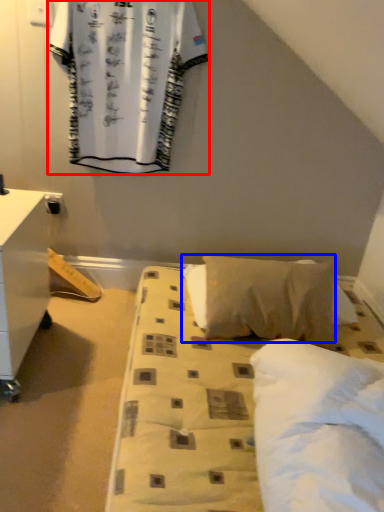
Question: Which object is further to the camera taking this photo, curtain (highlighted by a red box) or pillow (highlighted by a blue box)?

Choices:
 (A) curtain
 (B) pillow

Answer: (A)